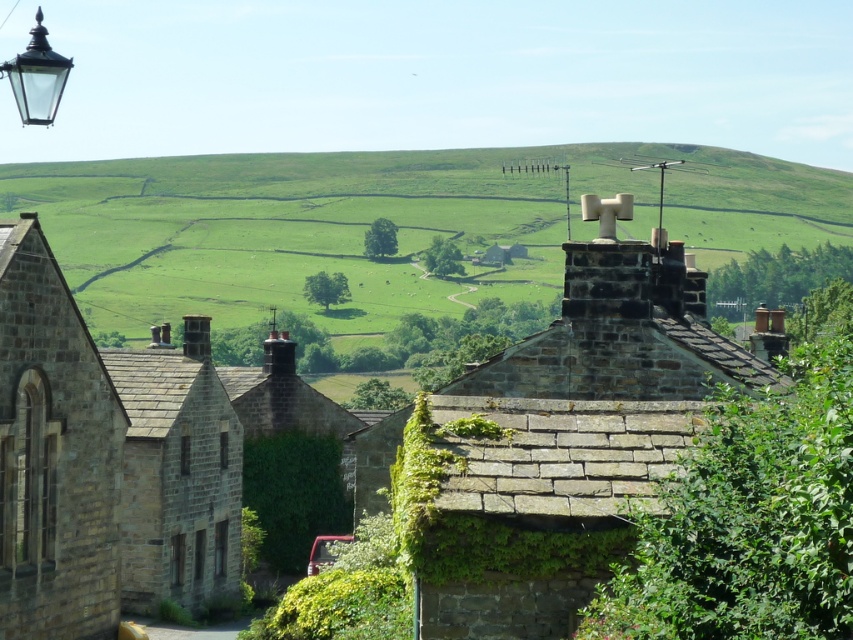
You are a drone operator planning to fly a drone from the matte glass streetlamp at upper left to the green grassy hillside at upper center. Given that your drone has a maximum range of 200 meters, will it be able to reach the destination without needing a recharge?

The distance between the matte glass streetlamp at upper left and the green grassy hillside at upper center is 207.59 meters. Since the drone has a maximum range of 200 meters, it will not be able to reach the destination without needing a recharge.

You are standing at the center of the image and want to locate the stone chimney at center. According to the coordinates provided, in which direction should you look to find it?

The stone chimney at center is located at coordinates point (x=575, y=435), so you should look to the right and slightly downward from the center to find it.

You are a painter setting up your easel to capture the rural scene. You want to ensure that both the stone chimney at center and the matte glass streetlamp at upper left are visible in your painting. Given their sizes, which object should you place closer to the center of your canvas to maintain their relative prominence?

The stone chimney at center is bigger than the matte glass streetlamp at upper left, so to maintain their relative prominence, you should place the stone chimney at center closer to the center of your canvas.